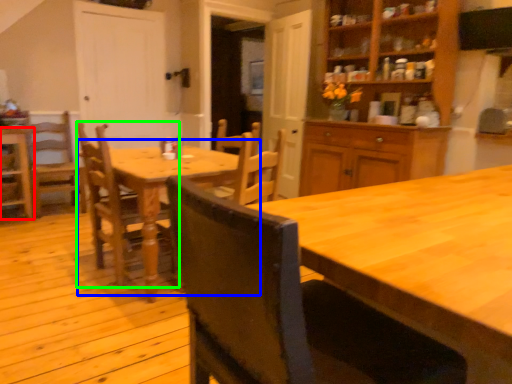
Question: Which object is positioned farthest from chair (highlighted by a red box)? Select from kitchen & dining room table (highlighted by a blue box) and chair (highlighted by a green box).

Choices:
 (A) kitchen & dining room table
 (B) chair

Answer: (A)